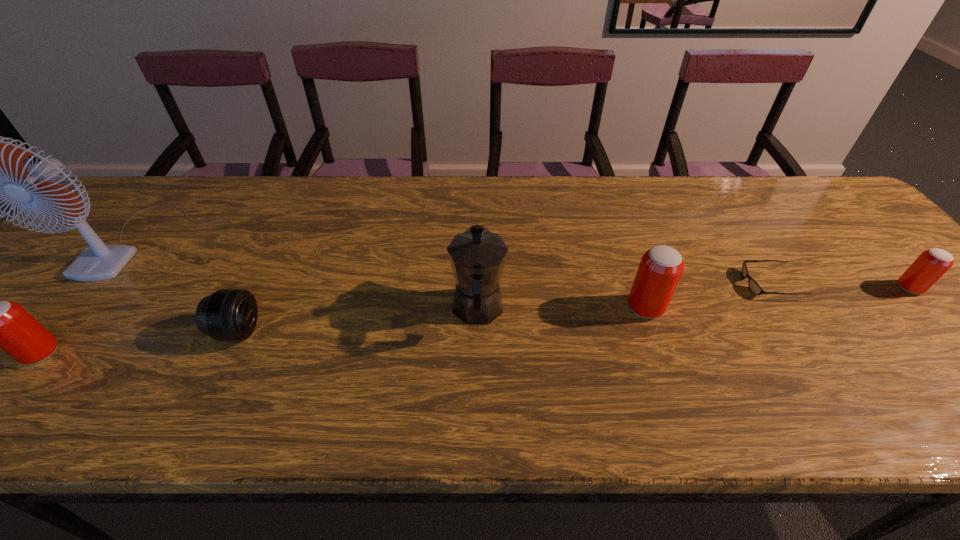
Locate an element on the screen. The height and width of the screenshot is (540, 960). the sixth shortest object is located at coordinates (477, 256).

You are a GUI agent. You are given a task and a screenshot of the screen. Output one action in this format:
    pyautogui.click(x=<x>, y=<y>)
    Task: Click on the fourth object from right to left
    The height and width of the screenshot is (540, 960).
    Given the screenshot: What is the action you would take?
    pyautogui.click(x=477, y=256)

You are a GUI agent. You are given a task and a screenshot of the screen. Output one action in this format:
    pyautogui.click(x=<x>, y=<y>)
    Task: Click on the free spot located 0.120m on the right of the fourth shortest object
    The height and width of the screenshot is (540, 960).
    Given the screenshot: What is the action you would take?
    pyautogui.click(x=115, y=353)

This screenshot has width=960, height=540. I want to click on free region located on the back of the tallest beer can, so (616, 226).

This screenshot has height=540, width=960. I want to click on vacant space located on the back of the rightmost object, so click(x=851, y=226).

This screenshot has width=960, height=540. I want to click on vacant space located on the front-facing side of the tallest object, so click(93, 304).

What are the coordinates of `vacant space located on the front-facing side of the telephoto lens` in the screenshot? It's located at (x=386, y=331).

The width and height of the screenshot is (960, 540). In order to click on vacant area located 0.250m on the front-facing side of the sunglasses in this screenshot , I will do `click(640, 284)`.

Find the location of a particular element. free space located 0.250m on the front-facing side of the sunglasses is located at coordinates (640, 284).

The width and height of the screenshot is (960, 540). Find the location of `vacant space located on the front-facing side of the sunglasses`. vacant space located on the front-facing side of the sunglasses is located at coordinates (657, 284).